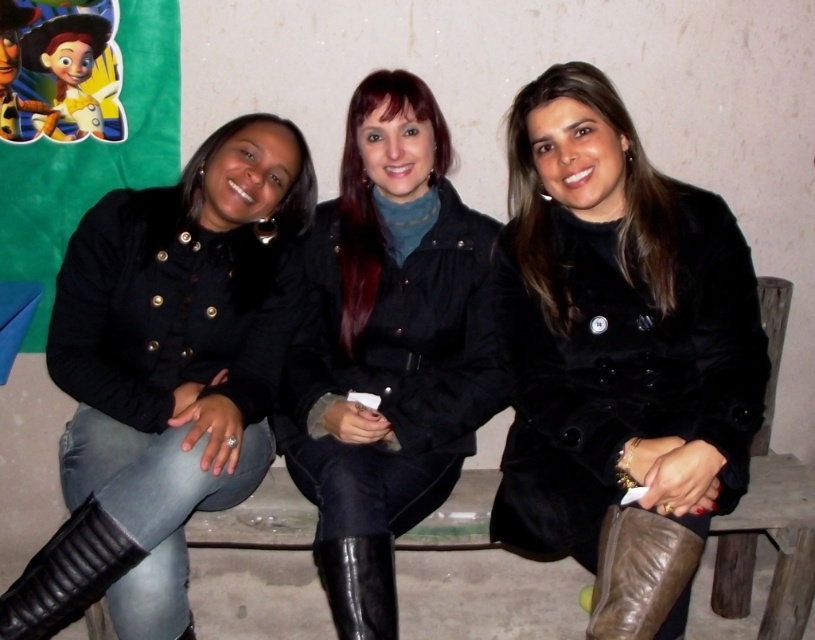
You are trying to determine which item is bigger between the black leather jacket at left and the leather boot at lower right in the image. Based on the scene, which one is larger?

The black leather jacket at left is larger than the leather boot at lower right according to the description.

You are a delivery robot with a package that is 18 inches wide. You need to place it between the leather boot at lower right and the black leather boot at lower center. Is there enough space?

The distance between the leather boot at lower right and the black leather boot at lower center is 17.55 inches, which is less than the package width of 18 inches. Therefore, there is not enough space to place the package between them.

You are standing 1.5 meters away from the black leather jacket at left. Can you reach it without moving your feet?

The distance between you and the black leather jacket at left is 1.49 meters, so yes, you can reach it without moving your feet since you are only 1.49 meters away, which is within the typical reaching distance.